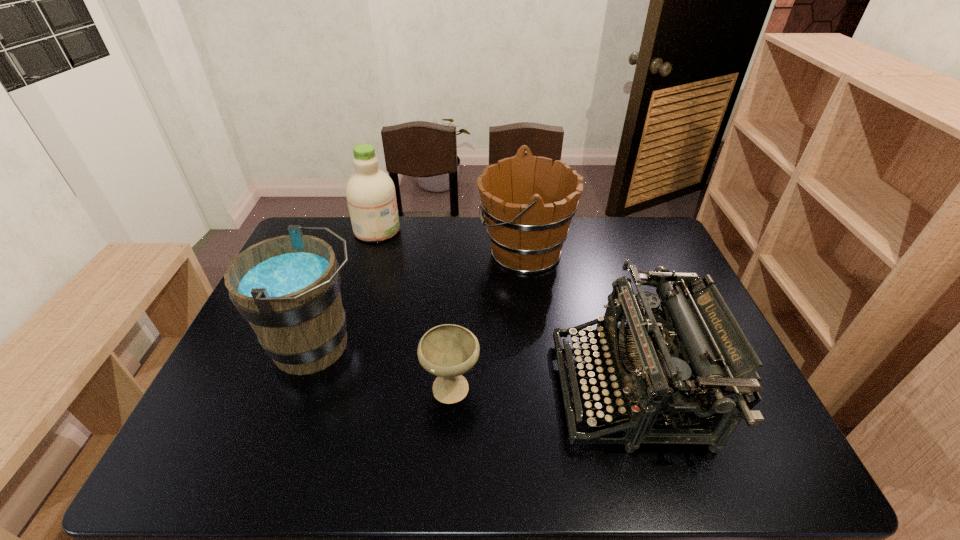
Image resolution: width=960 pixels, height=540 pixels. In order to click on cleansing agent in this screenshot , I will do `click(371, 197)`.

You are a GUI agent. You are given a task and a screenshot of the screen. Output one action in this format:
    pyautogui.click(x=<x>, y=<y>)
    Task: Click on the right wine bucket
    
    Given the screenshot: What is the action you would take?
    pyautogui.click(x=528, y=205)

The width and height of the screenshot is (960, 540). In order to click on the left wine bucket in this screenshot , I will do `click(288, 287)`.

At what (x,y) coordinates should I click in order to perform the action: click on typewriter. Please return your answer as a coordinate pair (x, y). Looking at the image, I should click on (662, 367).

What are the coordinates of `the shortest object` in the screenshot? It's located at (448, 351).

Where is `vacant space located 0.110m on the front label of the cleansing agent`? The image size is (960, 540). vacant space located 0.110m on the front label of the cleansing agent is located at coordinates (431, 230).

This screenshot has height=540, width=960. Identify the location of vacant region located with the handle on the farther wine bucket. (436, 252).

Locate an element on the screen. The width and height of the screenshot is (960, 540). vacant space located with the handle on the farther wine bucket is located at coordinates (385, 252).

At what (x,y) coordinates should I click in order to perform the action: click on free spot located 0.080m with the handle on the farther wine bucket. Please return your answer as a coordinate pair (x, y). The image size is (960, 540). Looking at the image, I should click on 454,252.

The width and height of the screenshot is (960, 540). I want to click on vacant space positioned with a handle on the side of the nearer wine bucket, so click(x=395, y=346).